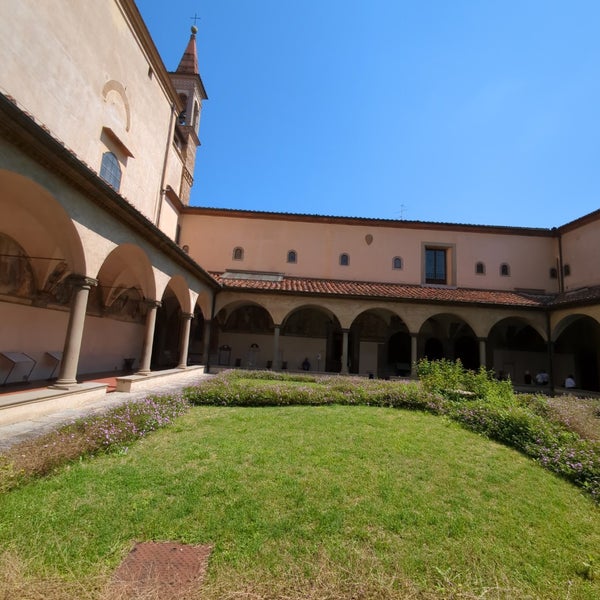
Locate an element on the screen. The height and width of the screenshot is (600, 600). wall is located at coordinates (39, 329).